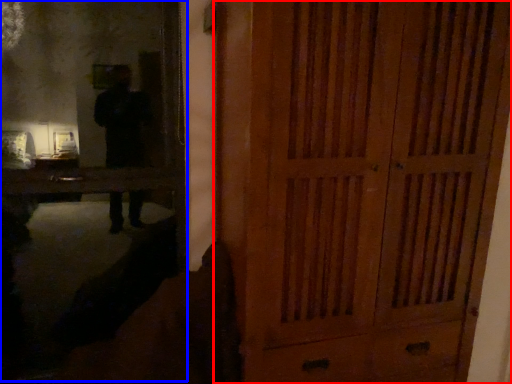
Question: Which point is closer to the camera, door (highlighted by a red box) or mirror (highlighted by a blue box)?

Choices:
 (A) door
 (B) mirror

Answer: (A)